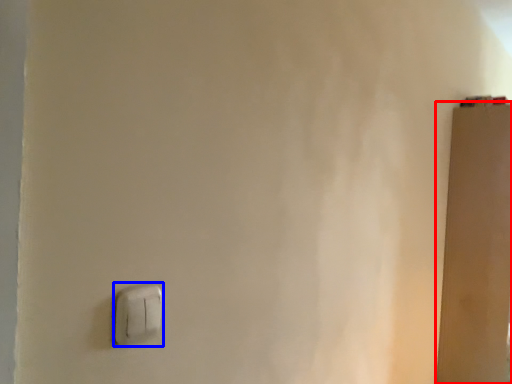
Question: Which object is closer to the camera taking this photo, door (highlighted by a red box) or light switch (highlighted by a blue box)?

Choices:
 (A) door
 (B) light switch

Answer: (B)